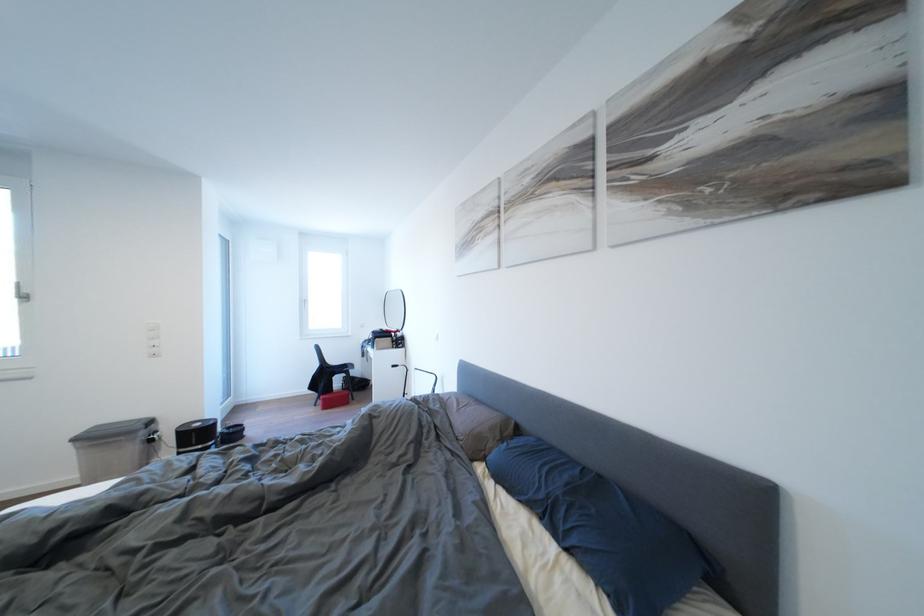
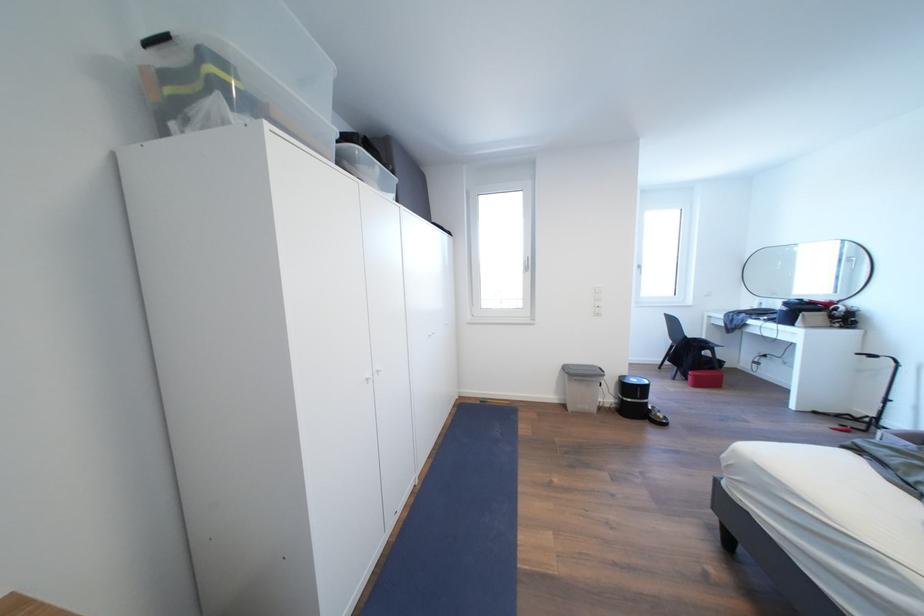
Where in the second image is the point corresponding to point 332,405 from the first image?

(703, 381)